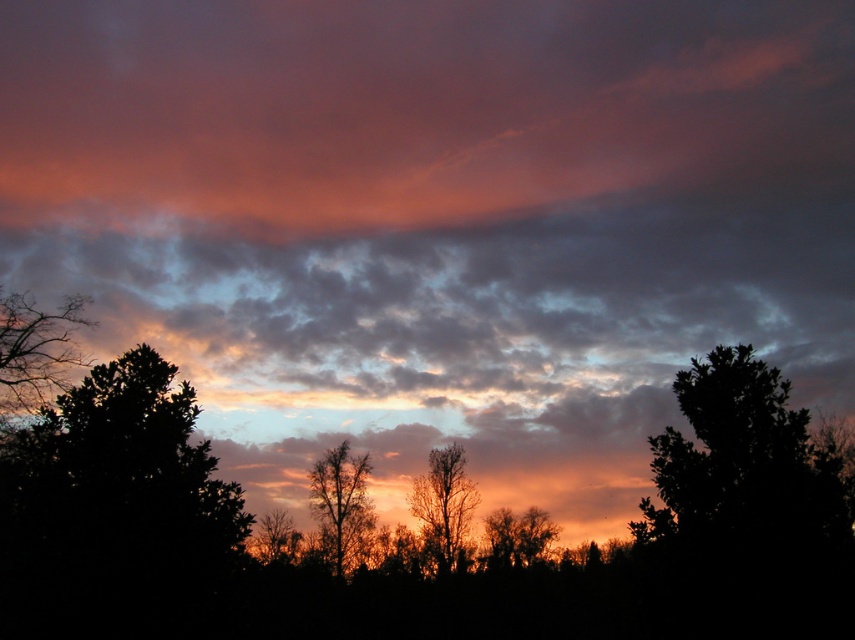
Question: Estimate the real-world distances between objects in this image. Which object is farther from the silhouette bare tree at center?

Choices:
 (A) bare branches at left
 (B) orange-brown bark tree at center
 (C) silhouette tree at lower center

Answer: (A)

Question: Estimate the real-world distances between objects in this image. Which object is closer to the dark green leafy tree at right?

Choices:
 (A) silhouette tree at lower center
 (B) bare branches at left
 (C) silhouette tree at center

Answer: (B)

Question: Can you confirm if dark green leafy tree at right is wider than silhouette tree at lower center?

Choices:
 (A) yes
 (B) no

Answer: (A)

Question: Can you confirm if dark green leafy tree at left is wider than silhouette bare tree at center?

Choices:
 (A) no
 (B) yes

Answer: (B)

Question: Which object is positioned closest to the dark green leafy tree at right?

Choices:
 (A) bare branches at left
 (B) dark green leafy tree at left
 (C) silhouette bare tree at center
 (D) silhouette tree at center

Answer: (B)

Question: Considering the relative positions of dark green leafy tree at right and bare branches at left in the image provided, where is dark green leafy tree at right located with respect to bare branches at left?

Choices:
 (A) above
 (B) below

Answer: (B)